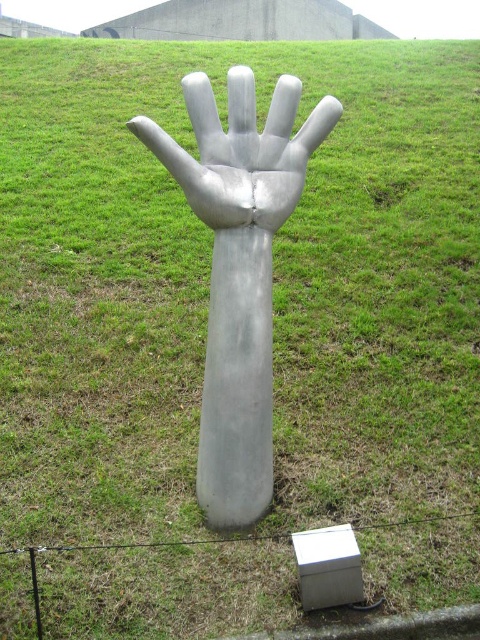
Question: Which of the following is the closest to the observer?

Choices:
 (A) shiny metallic hand at center
 (B) silver metallic hand at center

Answer: (A)

Question: Is silver metallic hand at center smaller than shiny metallic hand at center?

Choices:
 (A) yes
 (B) no

Answer: (B)

Question: Which of the following is the closest to the observer?

Choices:
 (A) shiny metallic hand at center
 (B) silver metallic hand at center

Answer: (A)

Question: Can you confirm if silver metallic hand at center is positioned below shiny metallic hand at center?

Choices:
 (A) yes
 (B) no

Answer: (A)

Question: Which point appears closest to the camera in this image?

Choices:
 (A) (210, 349)
 (B) (288, 134)

Answer: (A)

Question: Is silver metallic hand at center above shiny metallic hand at center?

Choices:
 (A) yes
 (B) no

Answer: (B)